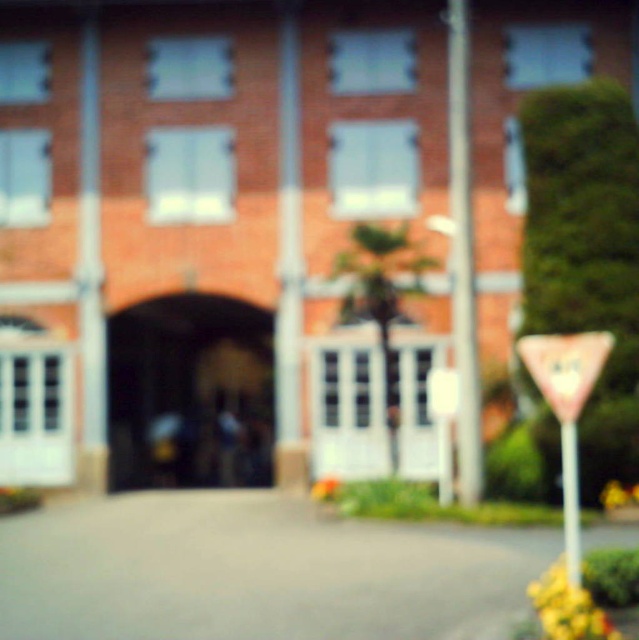
You are a pedestrian approaching the building and need to locate the pink plastic triangle at lower right and the pink paper stop sign at right. Which one do you see closer to you as you approach?

The pink plastic triangle at lower right is closer to you because it is further to the viewer than the pink paper stop sign at right.